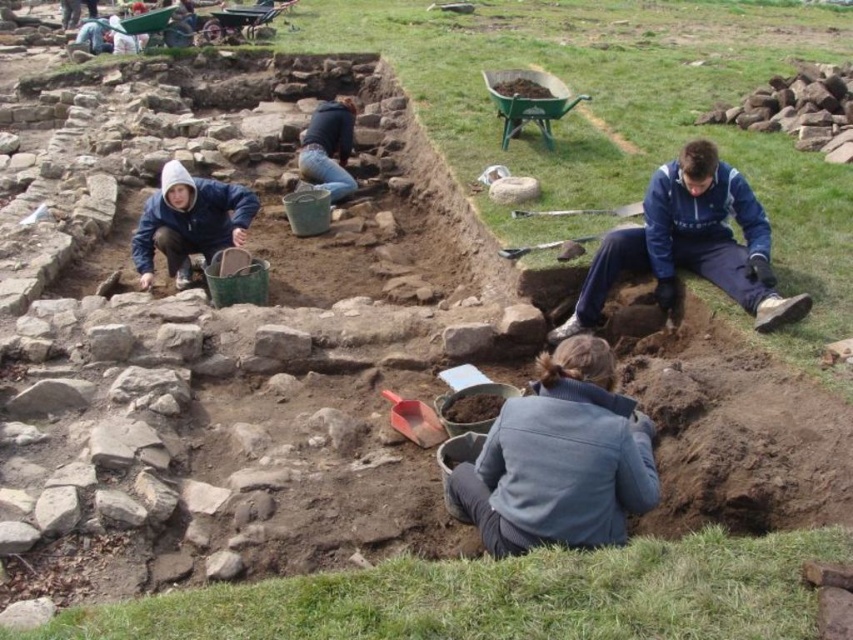
Question: Is blue fabric jacket at center bigger than smooth wooden shovel at center?

Choices:
 (A) yes
 (B) no

Answer: (A)

Question: Is blue fleece jacket at lower right wider than smooth wooden shovel at center?

Choices:
 (A) yes
 (B) no

Answer: (A)

Question: Which is nearer to the blue fleece jacket at lower right?

Choices:
 (A) blue fleece jacket at upper left
 (B) smooth wooden shovel at center

Answer: (B)

Question: Considering the real-world distances, which object is farthest from the blue denim jeans at center?

Choices:
 (A) brushed metal shovel at center
 (B) blue fleece jacket at upper left

Answer: (A)

Question: Does blue fleece jacket at lower right have a lesser width compared to smooth wooden shovel at center?

Choices:
 (A) no
 (B) yes

Answer: (A)

Question: Considering the real-world distances, which object is farthest from the blue fleece jacket at lower right?

Choices:
 (A) brushed metal shovel at center
 (B) smooth wooden shovel at center

Answer: (B)